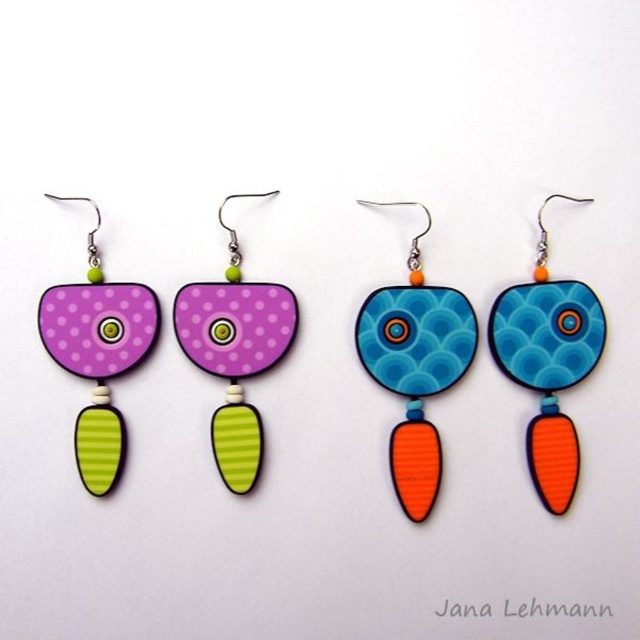
Who is more distant from viewer, (384, 298) or (582, 317)?

The point (384, 298) is more distant.

Is blue glossy circle at center closer to camera compared to blue glossy disc at center?

No, blue glossy circle at center is further to the viewer.

Which is in front, point (404, 435) or point (552, 308)?

Point (552, 308) is in front.

You are a GUI agent. You are given a task and a screenshot of the screen. Output one action in this format:
    pyautogui.click(x=<x>, y=<y>)
    Task: Click on the blue glossy circle at center
    This screenshot has height=640, width=640.
    Given the screenshot: What is the action you would take?
    pyautogui.click(x=416, y=365)

Can you confirm if blue glossy disc at center is bigger than matte purple wood earring at center?

Yes, blue glossy disc at center is bigger than matte purple wood earring at center.

Find the location of a particular element. The width and height of the screenshot is (640, 640). blue glossy disc at center is located at coordinates (548, 364).

In order to click on blue glossy disc at center in this screenshot , I will do `click(548, 364)`.

Can you confirm if blue glossy circle at center is positioned to the right of matte purple wood earring at left?

Yes, blue glossy circle at center is to the right of matte purple wood earring at left.

Identify the location of blue glossy circle at center. The height and width of the screenshot is (640, 640). (416, 365).

The image size is (640, 640). What are the coordinates of `blue glossy circle at center` in the screenshot? It's located at (416, 365).